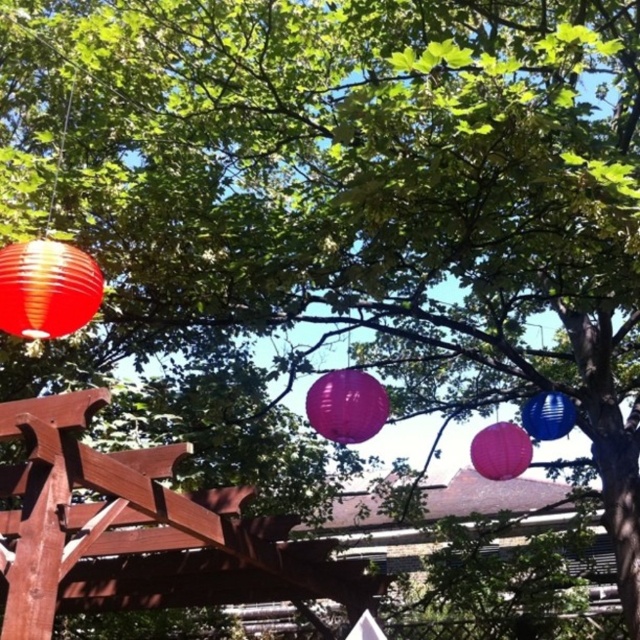
Question: Which of the following is the farthest from the observer?

Choices:
 (A) (61, 308)
 (B) (488, 468)
 (C) (355, 428)

Answer: (B)

Question: Which of the following is the farthest from the observer?

Choices:
 (A) purple paper lantern at center
 (B) purple glossy lantern at center

Answer: (A)

Question: Which object is closer to the camera taking this photo?

Choices:
 (A) blue glossy lantern at right
 (B) matte red paper lantern at left

Answer: (B)

Question: Is matte red paper lantern at left positioned behind blue glossy lantern at right?

Choices:
 (A) no
 (B) yes

Answer: (A)

Question: Is purple paper lantern at center wider than blue glossy lantern at right?

Choices:
 (A) no
 (B) yes

Answer: (B)

Question: Can you confirm if matte red paper lantern at left is bigger than purple glossy lantern at center?

Choices:
 (A) yes
 (B) no

Answer: (B)